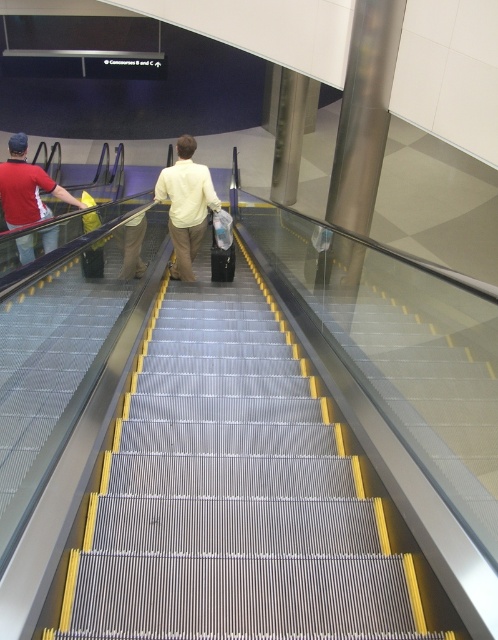
Question: Estimate the real-world distances between objects in this image. Which object is farther from the light yellow shirt at center?

Choices:
 (A) matte red shirt at left
 (B) metallic silver stairs at center

Answer: (B)

Question: Which point is farther to the camera?

Choices:
 (A) (33, 252)
 (B) (184, 273)

Answer: (B)

Question: Among these objects, which one is nearest to the camera?

Choices:
 (A) metallic silver stairs at center
 (B) light yellow shirt at center

Answer: (A)

Question: Can you confirm if metallic silver stairs at center is smaller than matte red shirt at left?

Choices:
 (A) yes
 (B) no

Answer: (B)

Question: Where is light yellow shirt at center located in relation to matte red shirt at left in the image?

Choices:
 (A) above
 (B) below

Answer: (A)

Question: Can you confirm if metallic silver stairs at center is positioned above matte red shirt at left?

Choices:
 (A) yes
 (B) no

Answer: (B)